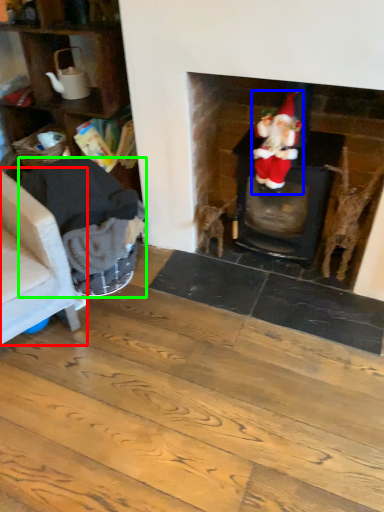
Question: Which is nearer to the armchair (highlighted by a red box)? person (highlighted by a blue box) or armchair (highlighted by a green box).

Choices:
 (A) person
 (B) armchair

Answer: (B)